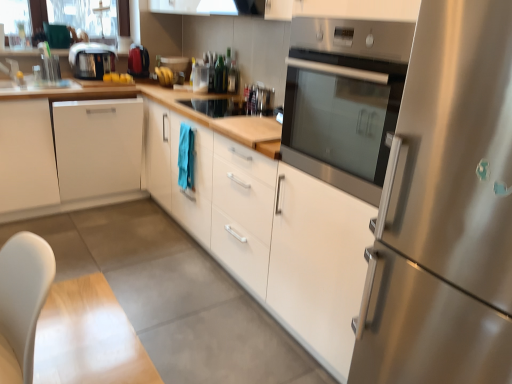
Question: Can we say stainless steel refrigerator at right lies outside white matte cabinet at center, arranged as the first cabinetry when viewed from the right?

Choices:
 (A) yes
 (B) no

Answer: (A)

Question: From the image's perspective, is stainless steel refrigerator at right located beneath white matte cabinet at center, arranged as the first cabinetry when viewed from the right?

Choices:
 (A) no
 (B) yes

Answer: (B)

Question: Considering the relative sizes of stainless steel refrigerator at right and white matte cabinet at center, arranged as the first cabinetry when viewed from the right, in the image provided, is stainless steel refrigerator at right thinner than white matte cabinet at center, arranged as the first cabinetry when viewed from the right,?

Choices:
 (A) no
 (B) yes

Answer: (A)

Question: Is white matte cabinet at center, arranged as the first cabinetry when viewed from the right, at the back of stainless steel refrigerator at right?

Choices:
 (A) yes
 (B) no

Answer: (B)

Question: From a real-world perspective, is stainless steel refrigerator at right physically above white matte cabinet at center, arranged as the first cabinetry when viewed from the right?

Choices:
 (A) no
 (B) yes

Answer: (B)

Question: Does stainless steel refrigerator at right touch white matte cabinet at center, placed as the second cabinetry when sorted from left to right?

Choices:
 (A) no
 (B) yes

Answer: (A)

Question: From the image's perspective, is white matte cabinet at center, arranged as the first cabinetry when viewed from the right, beneath satin black toaster at upper left?

Choices:
 (A) yes
 (B) no

Answer: (A)

Question: Is white matte cabinet at center, arranged as the first cabinetry when viewed from the right, shorter than satin black toaster at upper left?

Choices:
 (A) yes
 (B) no

Answer: (B)

Question: Is white matte cabinet at center, placed as the second cabinetry when sorted from left to right, touching satin black toaster at upper left?

Choices:
 (A) yes
 (B) no

Answer: (B)

Question: Is white matte cabinet at center, arranged as the first cabinetry when viewed from the right, oriented towards satin black toaster at upper left?

Choices:
 (A) yes
 (B) no

Answer: (B)

Question: Is white matte cabinet at center, placed as the second cabinetry when sorted from left to right, at the right side of satin black toaster at upper left?

Choices:
 (A) yes
 (B) no

Answer: (A)

Question: Is white matte cabinet at center, placed as the second cabinetry when sorted from left to right, far away from satin black toaster at upper left?

Choices:
 (A) no
 (B) yes

Answer: (B)

Question: Does stainless steel oven at center have a lesser width compared to white matte cabinet at left, acting as the first cabinetry starting from the left?

Choices:
 (A) no
 (B) yes

Answer: (B)